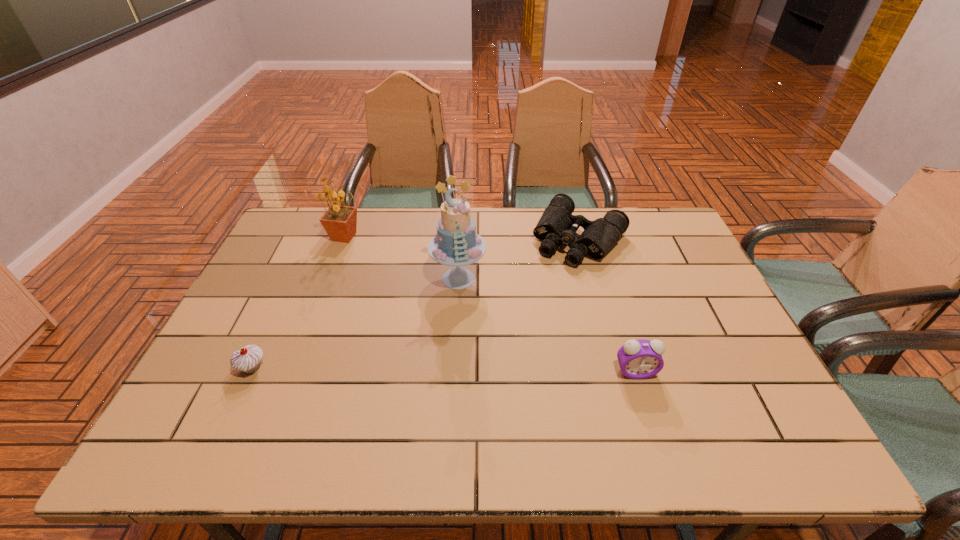
You are a GUI agent. You are given a task and a screenshot of the screen. Output one action in this format:
    pyautogui.click(x=<x>, y=<y>)
    Task: Click on the vacant point located between the cupcake and the alarm clock
    This screenshot has height=540, width=960.
    Given the screenshot: What is the action you would take?
    [444, 370]

This screenshot has width=960, height=540. Identify the location of free space that is in between the alarm clock and the binoculars. (608, 305).

Locate an element on the screen. The width and height of the screenshot is (960, 540). free spot between the leftmost object and the binoculars is located at coordinates (416, 303).

Where is `free area in between the alarm clock and the second tallest object`? The width and height of the screenshot is (960, 540). free area in between the alarm clock and the second tallest object is located at coordinates (491, 304).

Locate an element on the screen. free space between the shortest object and the alarm clock is located at coordinates (608, 305).

At what (x,y) coordinates should I click in order to perform the action: click on object that is the fourth closest to the binoculars. Please return your answer as a coordinate pair (x, y). Looking at the image, I should click on (247, 359).

Select which object appears as the fourth closest to the fourth shortest object. Please provide its 2D coordinates. Your answer should be formatted as a tuple, i.e. [(x, y)], where the tuple contains the x and y coordinates of a point satisfying the conditions above.

[(639, 359)]

Locate an element on the screen. This screenshot has height=540, width=960. free space that satisfies the following two spatial constraints: 1. on the front side of the sunflower; 2. on the right side of the binoculars is located at coordinates (345, 239).